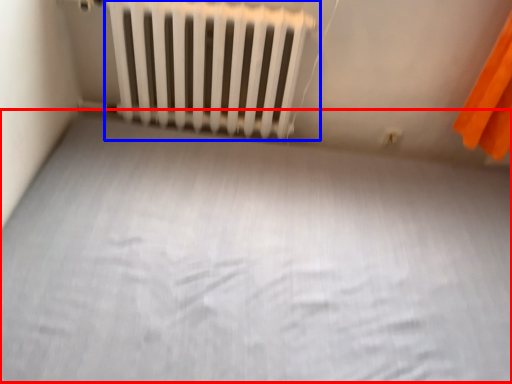
Question: Which of the following is the closest to the observer, bed frame (highlighted by a red box) or radiator (highlighted by a blue box)?

Choices:
 (A) bed frame
 (B) radiator

Answer: (A)